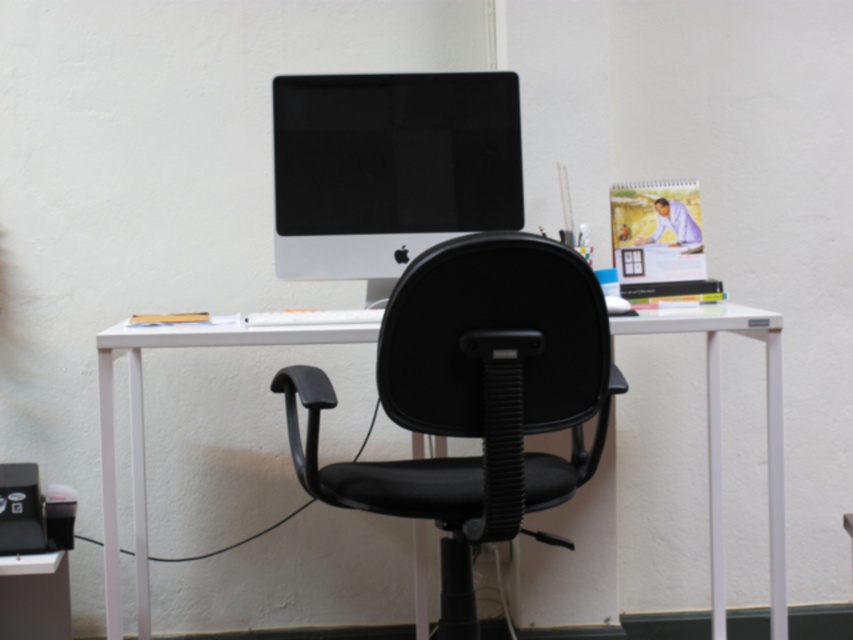
Question: In this image, where is black leather swivel chair at center located relative to sleek silver monitor at center?

Choices:
 (A) left
 (B) right

Answer: (B)

Question: Is the position of black leather swivel chair at center more distant than that of sleek silver monitor at center?

Choices:
 (A) yes
 (B) no

Answer: (B)

Question: Which of these objects is positioned farthest from the sleek silver monitor at center?

Choices:
 (A) black leather swivel chair at center
 (B) white plastic desk at center

Answer: (A)

Question: Which object appears farthest from the camera in this image?

Choices:
 (A) white plastic desk at center
 (B) sleek silver monitor at center

Answer: (B)

Question: Is the position of black leather swivel chair at center less distant than that of sleek silver monitor at center?

Choices:
 (A) yes
 (B) no

Answer: (A)

Question: Which of the following is the farthest from the observer?

Choices:
 (A) (331, 397)
 (B) (775, 472)

Answer: (B)